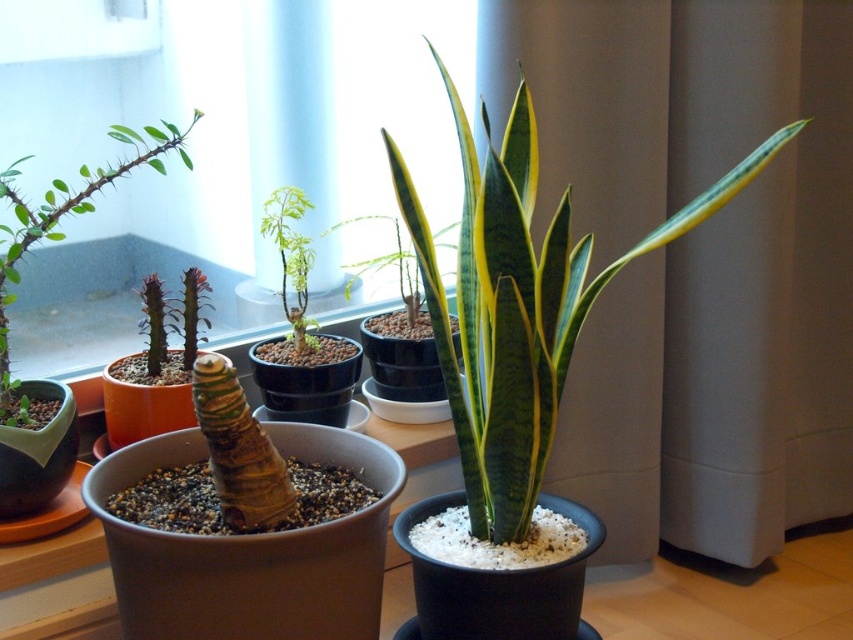
Question: Is green glossy snake plant at center thinner than green matte plant at center?

Choices:
 (A) yes
 (B) no

Answer: (B)

Question: Estimate the real-world distances between objects in this image. Which object is closer to the green spiky cactus at left?

Choices:
 (A) transparent glass window at upper center
 (B) green glossy snake plant at center
 (C) green glossy leaf at center

Answer: (A)

Question: Which point is farther to the camera?

Choices:
 (A) green glossy leaf at center
 (B) transparent glass window at upper center
 (C) green matte plant at center
 (D) green glossy snake plant at center

Answer: (A)

Question: Is green glossy snake plant at center closer to the viewer compared to green spiky cactus at left?

Choices:
 (A) no
 (B) yes

Answer: (B)

Question: Is green spiky cactus at left wider than green glossy leaf at center?

Choices:
 (A) yes
 (B) no

Answer: (A)

Question: Which object is the closest to the transparent glass window at upper center?

Choices:
 (A) green glossy snake plant at center
 (B) green spiky cactus at left
 (C) green matte plant at center
 (D) green glossy leaf at center

Answer: (B)